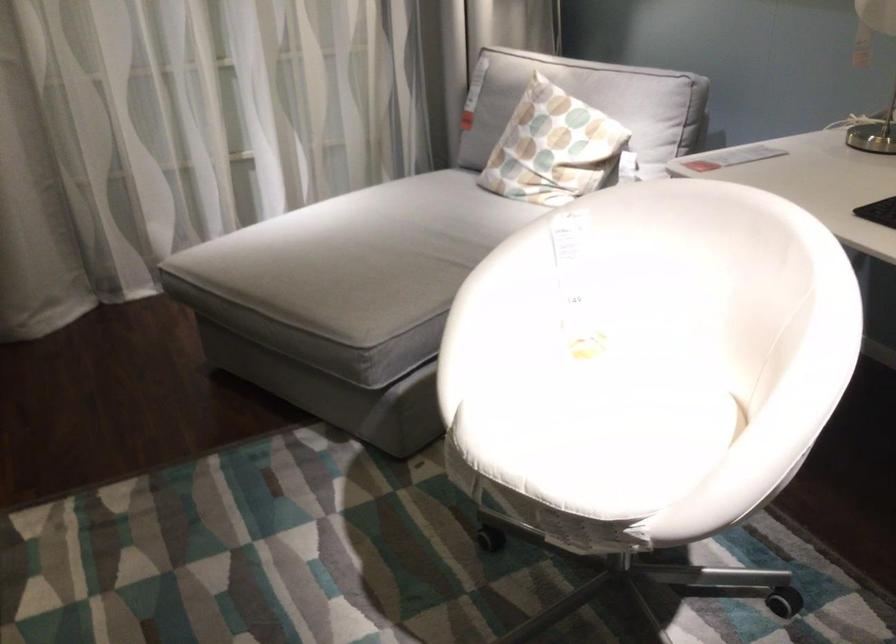
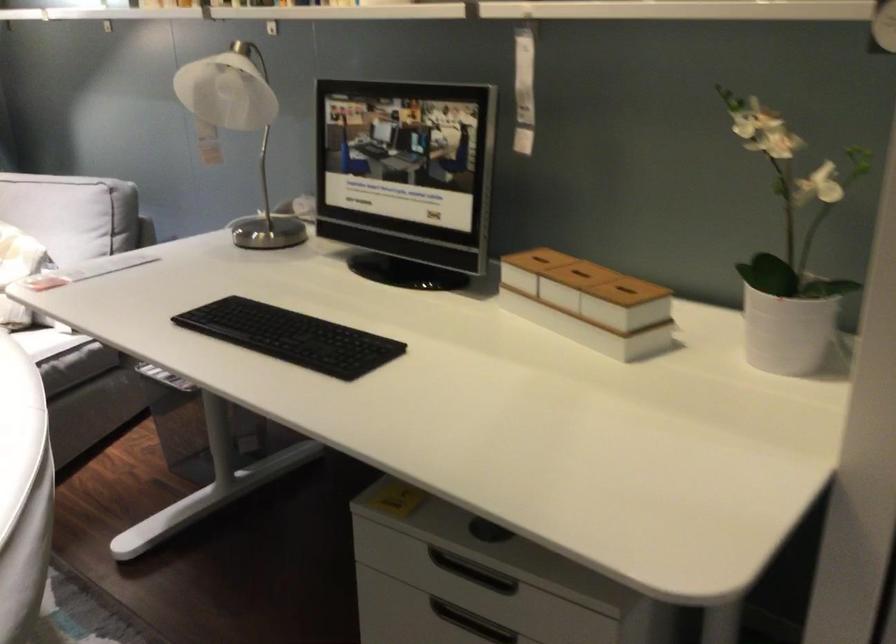
Question: The camera is either moving clockwise (left) or counter-clockwise (right) around the object. The first image is from the beginning of the video and the second image is from the end. Is the camera moving left or right when shooting the video?

Choices:
 (A) Left
 (B) Right

Answer: (A)